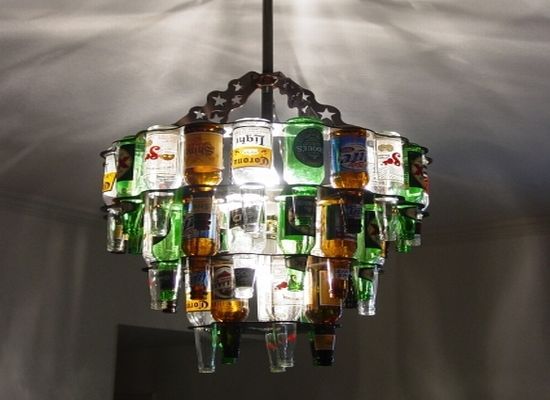
Where is `top of doorway`? This screenshot has width=550, height=400. top of doorway is located at coordinates (175, 335).